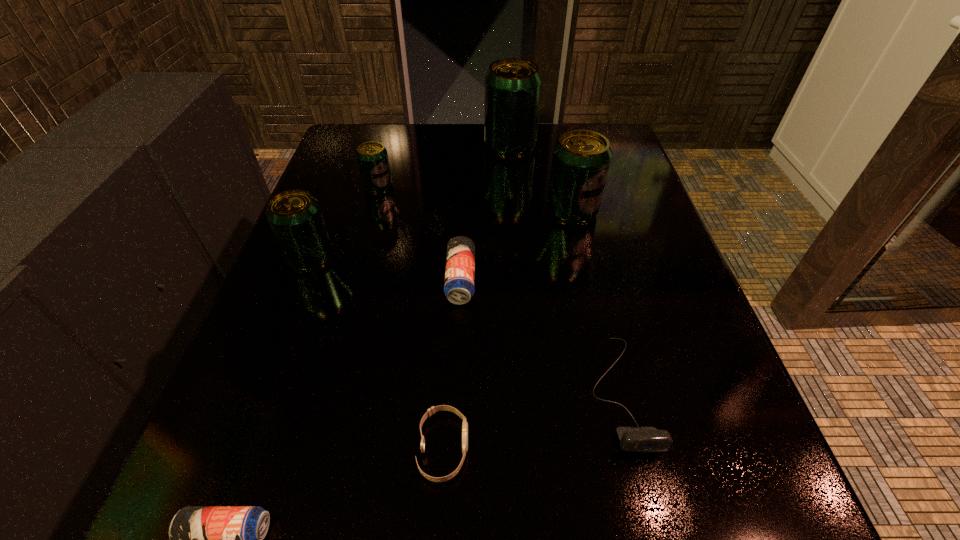
Where is `webcam`? The height and width of the screenshot is (540, 960). webcam is located at coordinates (645, 439).

Identify the location of watch. Image resolution: width=960 pixels, height=540 pixels. (430, 412).

This screenshot has width=960, height=540. Identify the location of free space located 0.290m on the front of the tallest object. (518, 238).

At what (x,y) coordinates should I click in order to perform the action: click on vacant space located on the left of the second tallest object. Please return your answer as a coordinate pair (x, y). The height and width of the screenshot is (540, 960). Looking at the image, I should click on (522, 212).

You are a GUI agent. You are given a task and a screenshot of the screen. Output one action in this format:
    pyautogui.click(x=<x>, y=<y>)
    Task: Click on the free region located on the front of the leftmost green beer can
    
    Given the screenshot: What is the action you would take?
    pyautogui.click(x=259, y=391)

Locate an element on the screen. This screenshot has height=540, width=960. vacant space situated on the back of the fourth tallest object is located at coordinates (396, 122).

You are a GUI agent. You are given a task and a screenshot of the screen. Output one action in this format:
    pyautogui.click(x=<x>, y=<y>)
    Task: Click on the free location located 0.230m on the front of the farther blue beer can
    Image resolution: width=960 pixels, height=540 pixels.
    Given the screenshot: What is the action you would take?
    click(454, 436)

The height and width of the screenshot is (540, 960). In order to click on vacant space located on the front-facing side of the webcam in this screenshot , I will do `click(645, 498)`.

Locate an element on the screen. This screenshot has height=540, width=960. free spot located 0.360m on the face of the watch is located at coordinates (738, 448).

The image size is (960, 540). Identify the location of object that is positioned at the far edge. (513, 86).